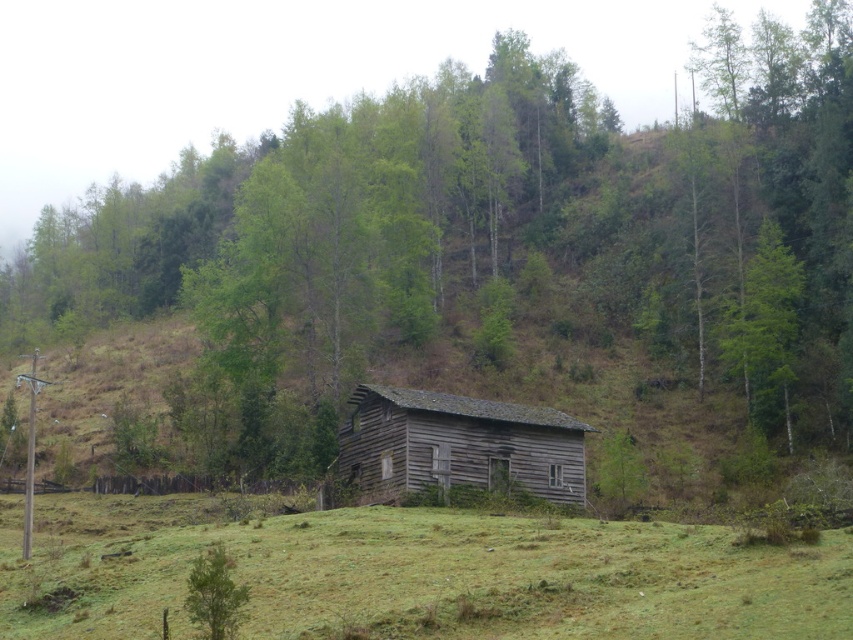
Question: Does green grassy field at lower center have a greater width compared to weathered wood barn at center?

Choices:
 (A) yes
 (B) no

Answer: (A)

Question: Does green grassy field at lower center have a lesser width compared to weathered wood barn at center?

Choices:
 (A) no
 (B) yes

Answer: (A)

Question: Which point appears closest to the camera in this image?

Choices:
 (A) (103, 497)
 (B) (445, 417)

Answer: (B)

Question: Is green grassy field at lower center thinner than weathered wood barn at center?

Choices:
 (A) no
 (B) yes

Answer: (A)

Question: Which object appears closest to the camera in this image?

Choices:
 (A) weathered wood barn at center
 (B) green grassy field at lower center

Answer: (B)